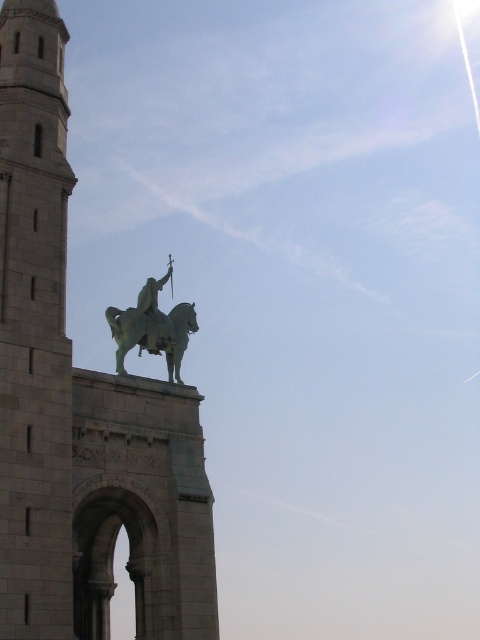
Between gray stone tower at center and gray stone tower at upper left, which one appears on the right side from the viewer's perspective?

gray stone tower at center is more to the right.

Is gray stone tower at center positioned before gray stone tower at upper left?

No, gray stone tower at center is behind gray stone tower at upper left.

Is point (56, 13) farther from viewer compared to point (38, 380)?

Yes, point (56, 13) is behind point (38, 380).

Locate an element on the screen. gray stone tower at center is located at coordinates (81, 404).

Does gray stone tower at upper left have a lesser width compared to green polished metal statue at upper center?

No.

Is point (11, 221) closer to viewer compared to point (142, 307)?

Yes, it is.

Identify the location of gray stone tower at upper left. The image size is (480, 640). (34, 326).

Can you confirm if gray stone tower at center is shorter than green polished metal statue at upper center?

In fact, gray stone tower at center may be taller than green polished metal statue at upper center.

Does gray stone tower at center have a greater height compared to green polished metal statue at upper center?

Yes.

What do you see at coordinates (81, 404) in the screenshot? The image size is (480, 640). I see `gray stone tower at center` at bounding box center [81, 404].

Locate an element on the screen. The height and width of the screenshot is (640, 480). gray stone tower at center is located at coordinates [x=81, y=404].